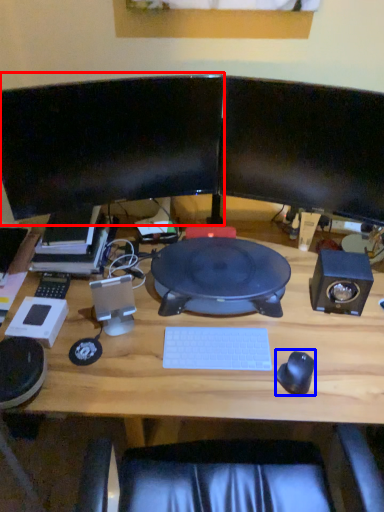
Question: Among these objects, which one is nearest to the camera, computer monitor (highlighted by a red box) or mouse (highlighted by a blue box)?

Choices:
 (A) computer monitor
 (B) mouse

Answer: (B)